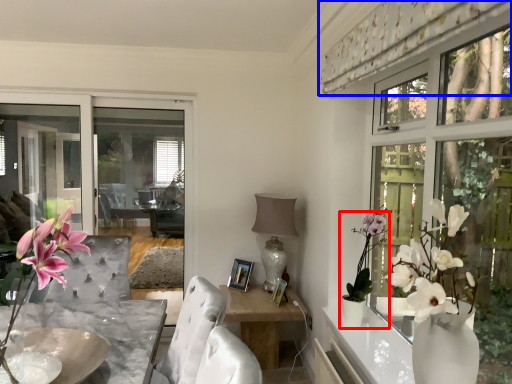
Question: Which object is closer to the camera taking this photo, houseplant (highlighted by a red box) or curtain (highlighted by a blue box)?

Choices:
 (A) houseplant
 (B) curtain

Answer: (B)